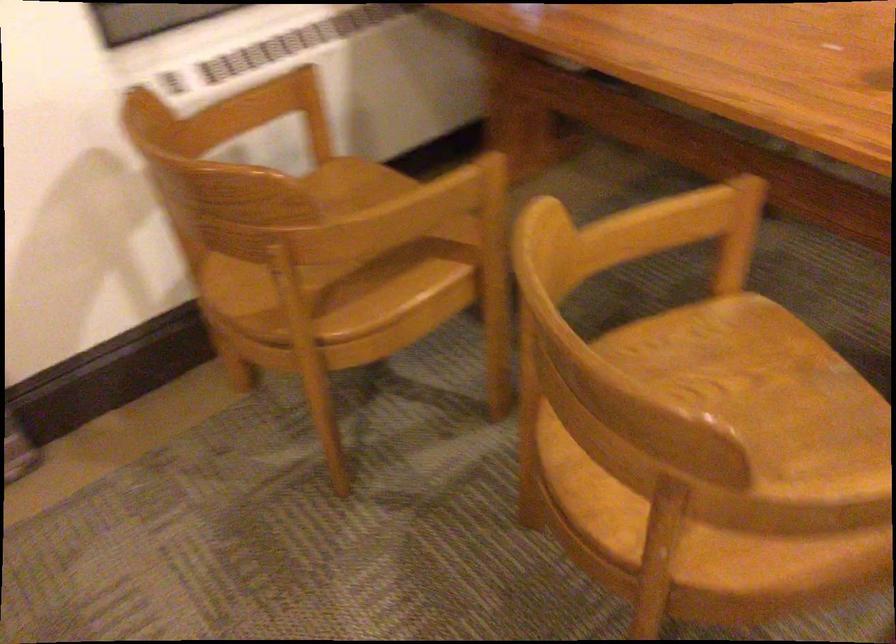
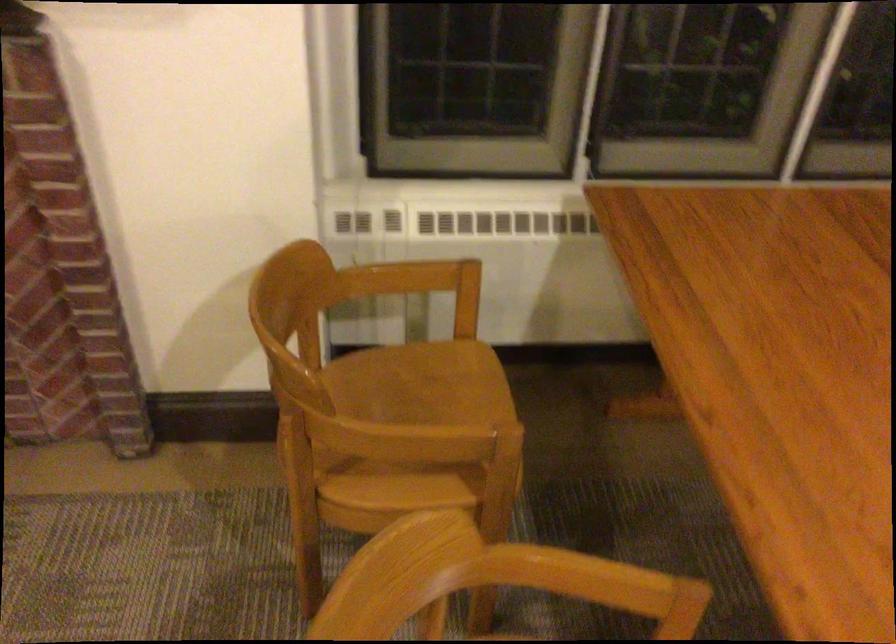
Question: The camera is either moving clockwise (left) or counter-clockwise (right) around the object. The first image is from the beginning of the video and the second image is from the end. Is the camera moving left or right when shooting the video?

Choices:
 (A) Left
 (B) Right

Answer: (B)